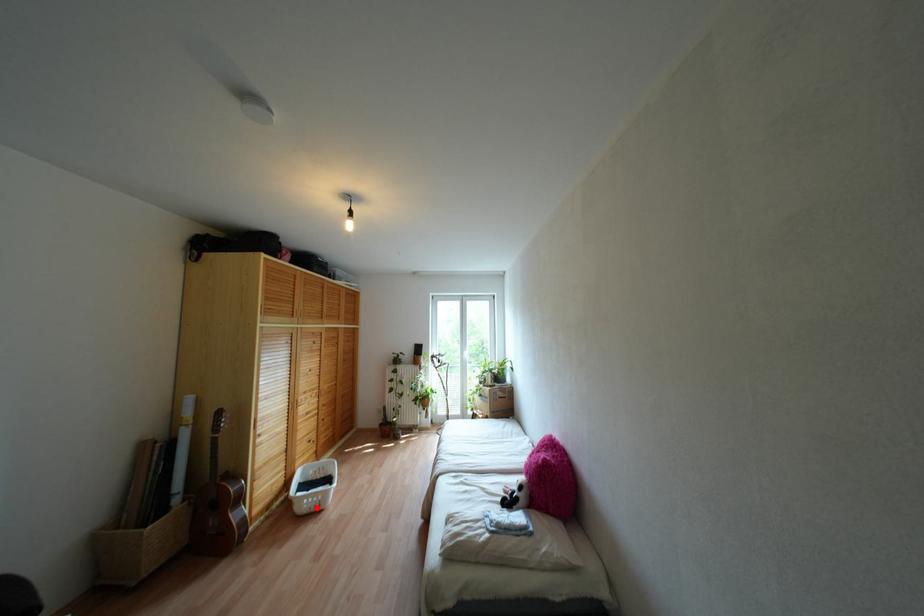
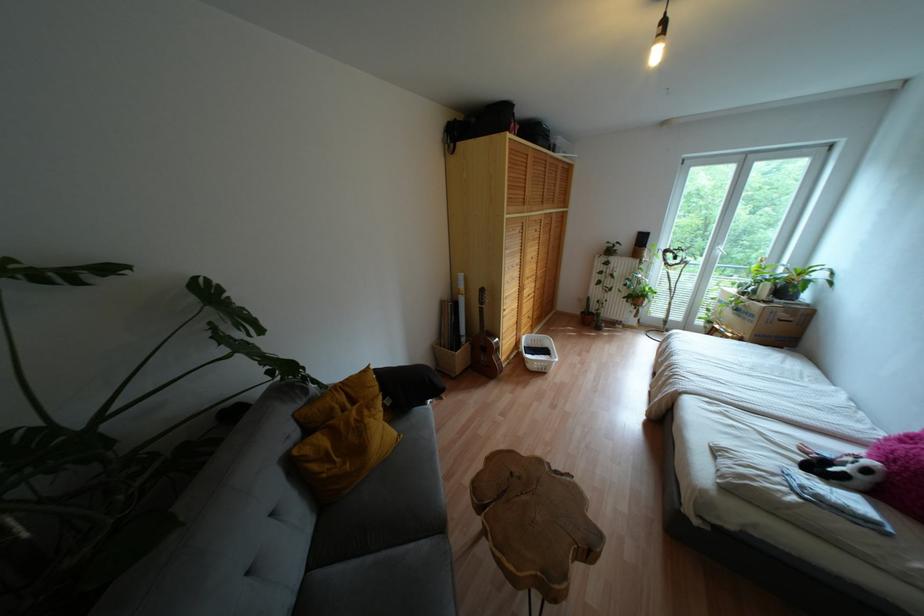
Locate, in the second image, the point that corresponds to the highlighted location in the first image.

(542, 370)